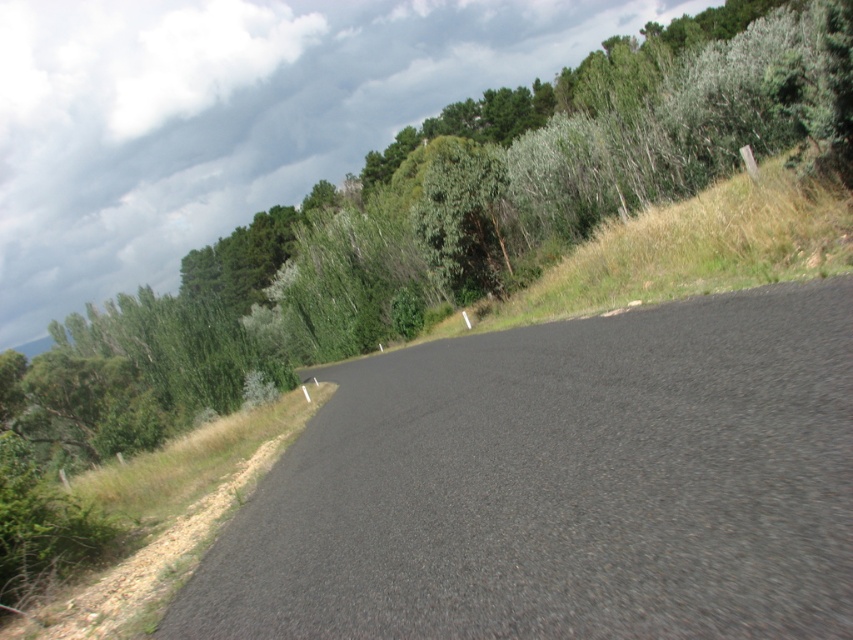
Who is higher up, black asphalt road at center or green leafy tree at upper left?

Positioned higher is green leafy tree at upper left.

Is point (370, 378) positioned behind point (780, 145)?

No.

Find the location of a particular element. This screenshot has height=640, width=853. black asphalt road at center is located at coordinates (561, 484).

Where is `black asphalt road at center`? This screenshot has height=640, width=853. black asphalt road at center is located at coordinates (561, 484).